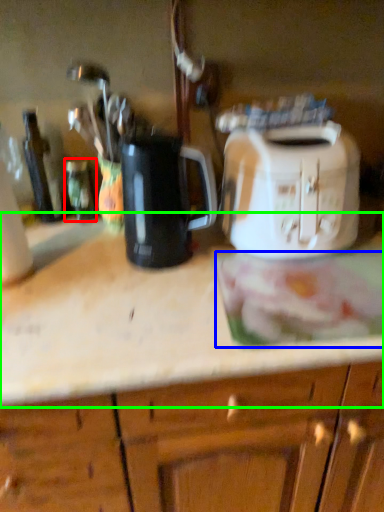
Question: Which object is the farthest from bottle (highlighted by a red box)? Choose among these: food (highlighted by a blue box) or countertop (highlighted by a green box).

Choices:
 (A) food
 (B) countertop

Answer: (A)